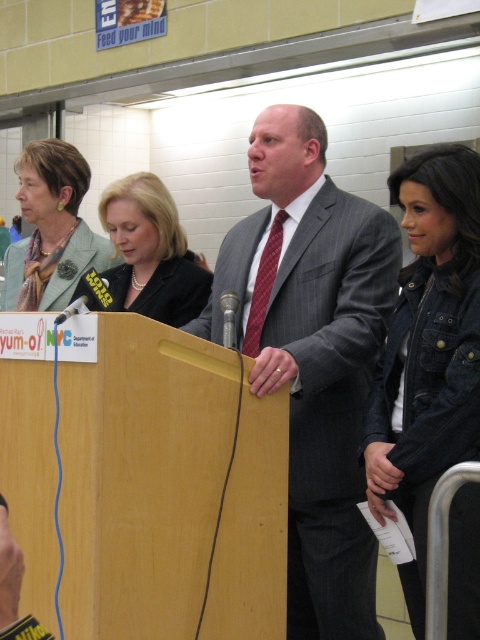
You are an attendee at this event and want to take a photo of the speaker. The denim jacket at lower right and the black leather jacket at center are blocking your view. Which jacket should you move to get a better view?

The denim jacket at lower right is in front of the black leather jacket at center. To get a better view, you should move the denim jacket at lower right first since it is closer to you and blocking the path.

You are an event organizer who needs to ensure that all items on the podium are visible to the audience. Considering the gray pinstripe suit at center and the metallic silver microphone at center, which item is wider and might block the view of the other?

The gray pinstripe suit at center is wider than the metallic silver microphone at center, so it might block the view of the microphone if positioned too closely.